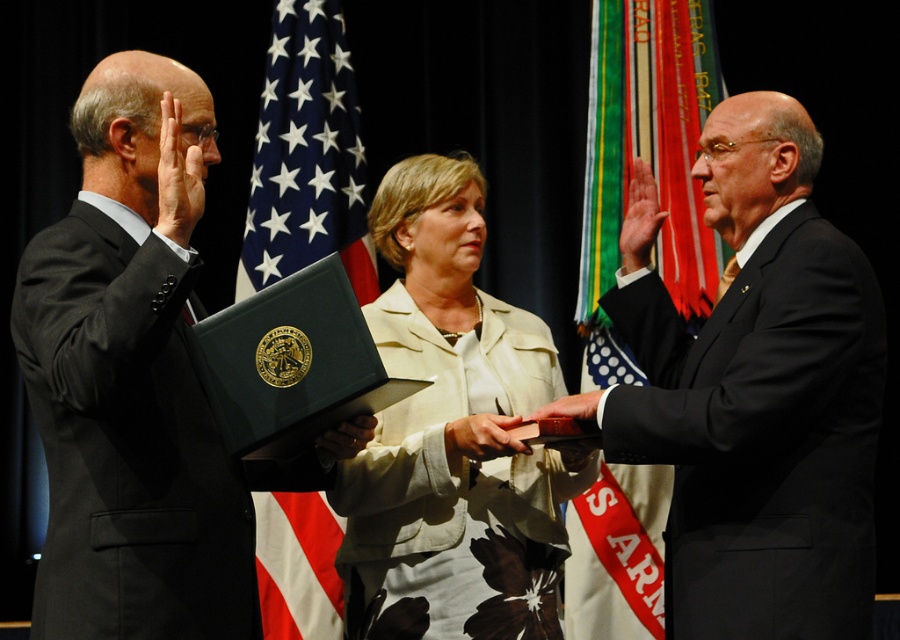
You are an event photographer at the swearing in ceremony. You need to capture a closeup shot of both the beige fabric jacket at center and the green fabric flag at center. Since your camera can only focus on one object at a time, which object should you choose to ensure the other is still in the frame?

The beige fabric jacket at center is smaller in size compared to the green fabric flag at center. To ensure both are in the frame, focus on the larger object, the green fabric flag at center, as it will occupy more space and allow the smaller beige fabric jacket at center to remain visible in the background.

You are a photographer positioned at the back of the room. You need to capture a closeup shot of both the beige fabric jacket at center and the blue fabric flag at center in the same frame. Given the camera you have can focus on objects within a 10 feet range, will you be able to do this?

The distance between the beige fabric jacket at center and the blue fabric flag at center is 12.50 feet. Since the camera can only focus on objects within a 10 feet range, you will not be able to capture both in the same frame with proper focus.